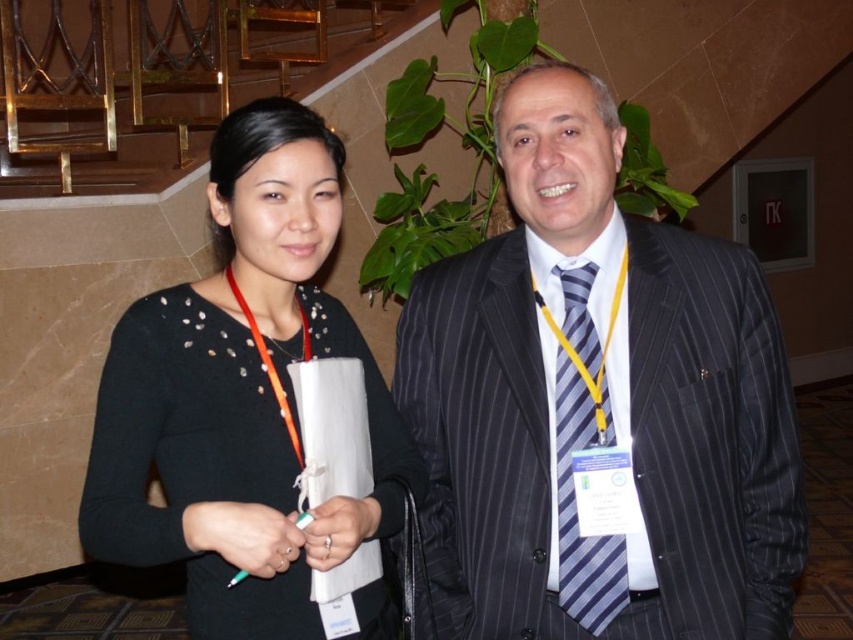
Is striped fabric suit at center further to the viewer compared to black matte sweater at center?

Yes, striped fabric suit at center is behind black matte sweater at center.

Which is behind, point (585, 362) or point (202, 349)?

Positioned behind is point (585, 362).

Find the location of a particular element. This screenshot has height=640, width=853. striped fabric suit at center is located at coordinates (598, 404).

Image resolution: width=853 pixels, height=640 pixels. I want to click on black matte sweater at center, so click(x=241, y=396).

This screenshot has height=640, width=853. Describe the element at coordinates (241, 396) in the screenshot. I see `black matte sweater at center` at that location.

Is point (248, 113) positioned after point (581, 586)?

No, it is not.

The image size is (853, 640). Identify the location of black matte sweater at center. (241, 396).

Which is above, striped fabric suit at center or blue striped tie at center?

striped fabric suit at center is above.

Can you confirm if striped fabric suit at center is positioned below blue striped tie at center?

Incorrect, striped fabric suit at center is not positioned below blue striped tie at center.

Is point (573, 452) more distant than point (582, 264)?

No, (573, 452) is closer to viewer.

Where is `striped fabric suit at center`? The image size is (853, 640). striped fabric suit at center is located at coordinates (598, 404).